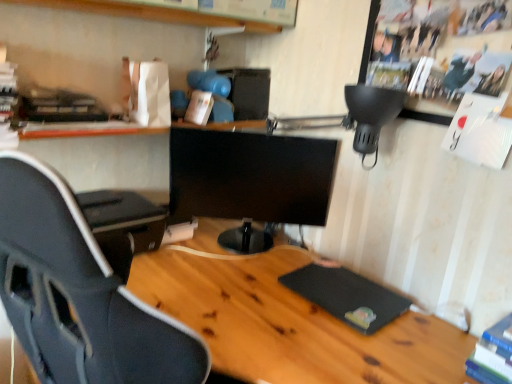
Where is `free space above black glossy monitor at center (from a real-world perspective)`? The image size is (512, 384). free space above black glossy monitor at center (from a real-world perspective) is located at coordinates (259, 135).